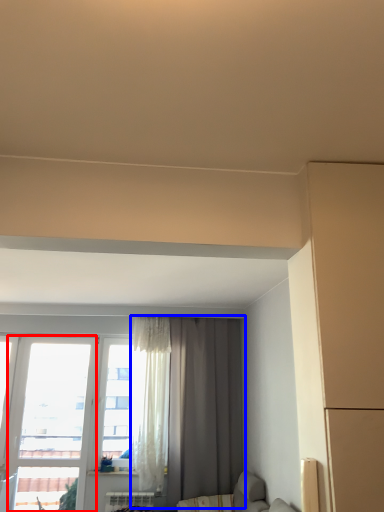
Question: Among these objects, which one is nearest to the camera, window (highlighted by a red box) or curtain (highlighted by a blue box)?

Choices:
 (A) window
 (B) curtain

Answer: (B)